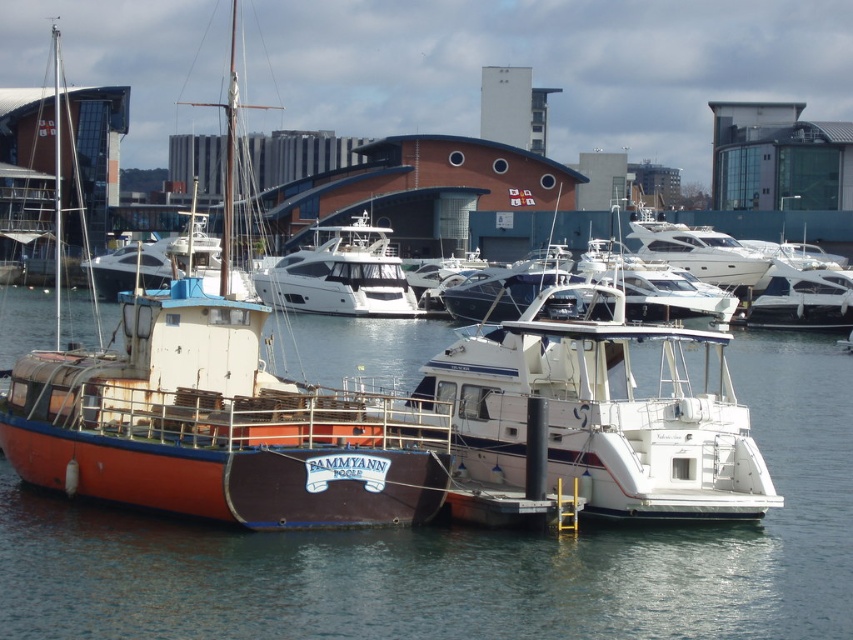
You are a dock worker who needs to secure both the white glossy boat at center and the white glossy yacht at center. Based on their positions, which one should you secure first to ensure stability?

The white glossy boat at center is below the white glossy yacht at center, so you should secure the white glossy yacht at center first to prevent it from shifting and affecting the boat below.

You are standing on the dock and want to take a photo of the white glossy boat at center and the smooth water at center. Which object should you focus on first if you want to capture both in a single shot without moving the camera? Explain your reasoning based on their positions.

The smooth water at center is to the left of the white glossy boat at center. To capture both in a single shot without moving the camera, you should focus on the white glossy boat at center first since it is positioned to the right of the smooth water at center, allowing the camera to frame both objects by adjusting the angle to include both the left and right positions.

You are a boat inspector who needs to board the white glossy yacht at center from the white glossy boat at center. The boat inspector has a 45 meter long inspection rope. Can you safely reach the yacht using the rope?

The white glossy boat at center and white glossy yacht at center are 44.99 meters apart, so the 45 meter rope is long enough to safely reach the yacht.